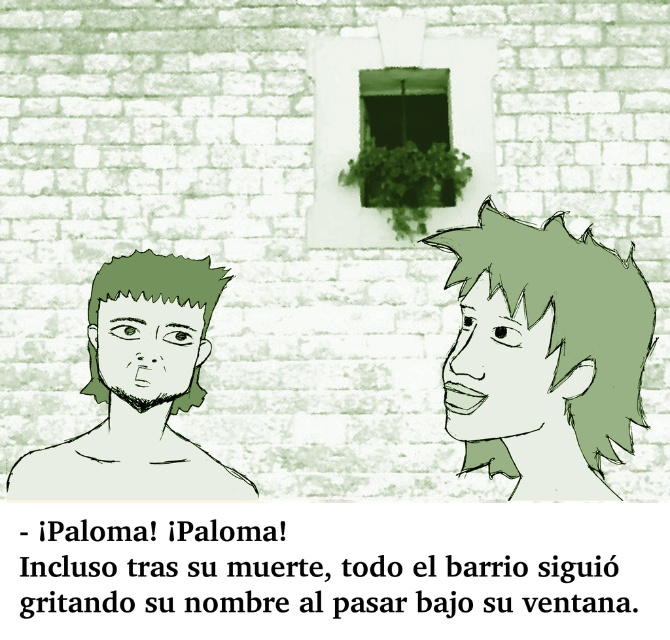
Question: Based on their relative distances, which object is farther from the green matte face at right?

Choices:
 (A) green spiky hair at right
 (B) green matte head at left
 (C) green matte face at center

Answer: (B)

Question: Which point is closer to the camera?

Choices:
 (A) green spiky hair at right
 (B) green matte face at center

Answer: (A)

Question: Can you confirm if green spiky hair at right is positioned to the right of green matte head at left?

Choices:
 (A) no
 (B) yes

Answer: (B)

Question: Is the position of green matte head at left less distant than that of green matte face at center?

Choices:
 (A) no
 (B) yes

Answer: (A)

Question: Which object appears closest to the camera in this image?

Choices:
 (A) green matte face at center
 (B) green matte face at right
 (C) green matte head at left

Answer: (B)

Question: Is green matte face at right in front of green matte face at center?

Choices:
 (A) yes
 (B) no

Answer: (A)